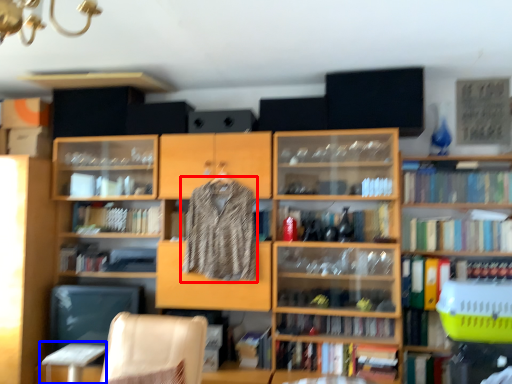
Question: Among these objects, which one is farthest to the camera, clothing (highlighted by a red box) or table (highlighted by a blue box)?

Choices:
 (A) clothing
 (B) table

Answer: (A)